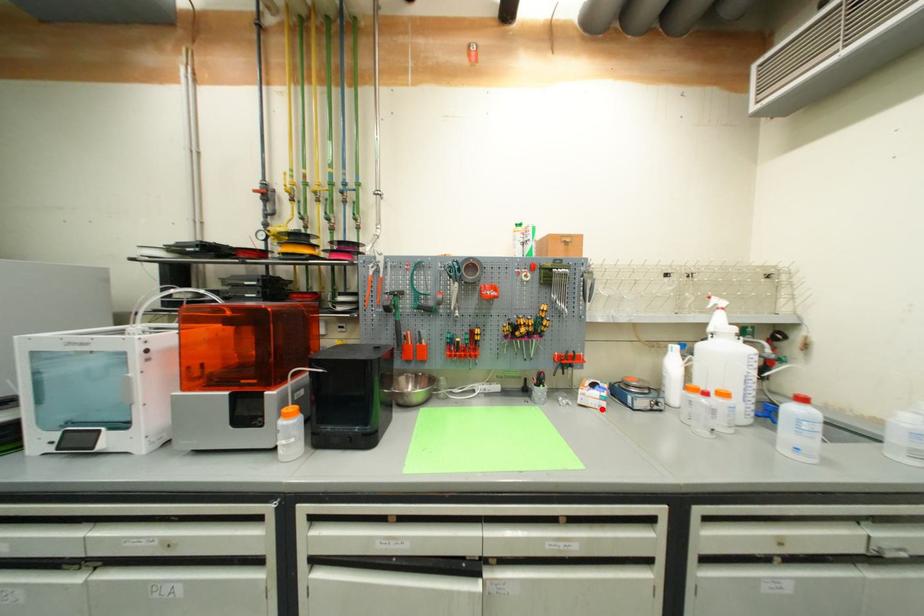
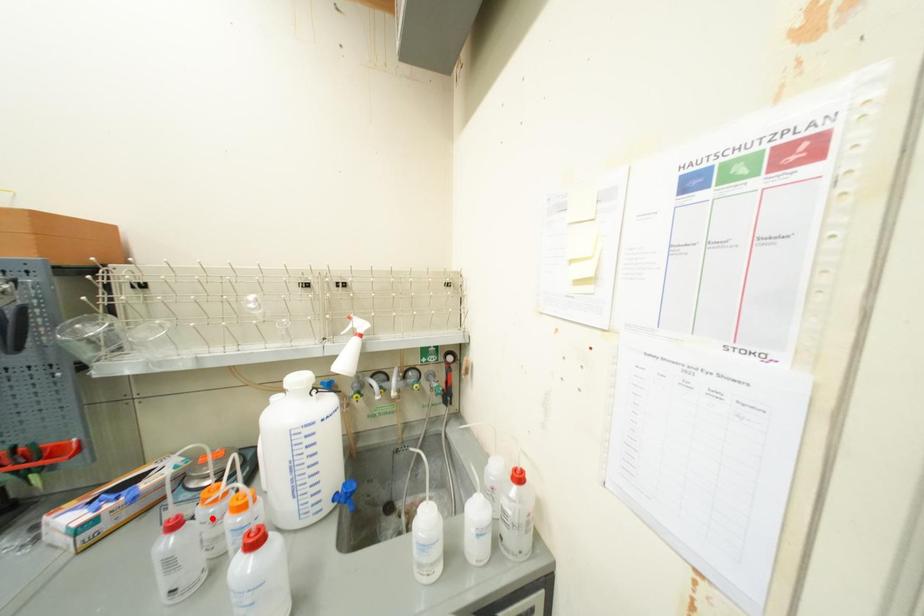
Consider the image. I am providing you with two images of the same scene from different viewpoints. A red point is marked on the first image and another point is marked on the second image. Is the marked point in image1 the same physical position as the marked point in image2?

No